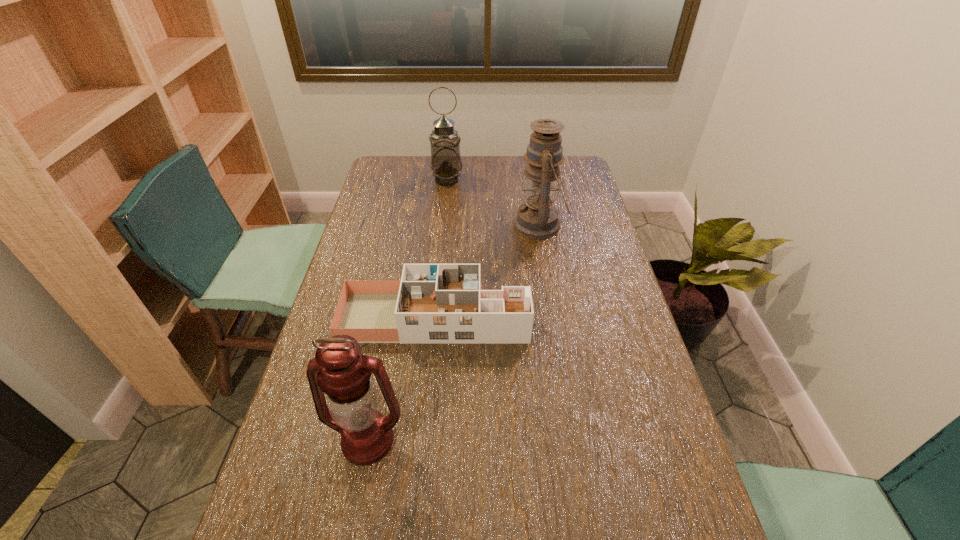
This screenshot has height=540, width=960. Find the location of `the second nearest oil lamp`. the second nearest oil lamp is located at coordinates coord(538,218).

This screenshot has height=540, width=960. In order to click on the second farthest object in this screenshot , I will do `click(538, 218)`.

You are a GUI agent. You are given a task and a screenshot of the screen. Output one action in this format:
    pyautogui.click(x=<x>, y=<y>)
    Task: Click on the farthest oil lamp
    
    Given the screenshot: What is the action you would take?
    tap(446, 165)

You are a GUI agent. You are given a task and a screenshot of the screen. Output one action in this format:
    pyautogui.click(x=<x>, y=<y>)
    Task: Click on the nearest oil lamp
    The image size is (960, 540).
    Given the screenshot: What is the action you would take?
    pyautogui.click(x=338, y=369)

Where is `the third farthest object`? the third farthest object is located at coordinates (436, 303).

This screenshot has width=960, height=540. I want to click on dollhouse, so click(436, 303).

Locate an element on the screen. Image resolution: width=960 pixels, height=540 pixels. vacant space situated on the right of the second nearest oil lamp is located at coordinates (596, 225).

Identify the location of vacant space located 0.280m on the right of the farthest oil lamp. The width and height of the screenshot is (960, 540). (531, 180).

Where is `vacant region located on the left of the nearest object`? vacant region located on the left of the nearest object is located at coordinates (295, 441).

You are a GUI agent. You are given a task and a screenshot of the screen. Output one action in this format:
    pyautogui.click(x=<x>, y=<y>)
    Task: Click on the blank space located at the entrance of the second nearest object
    
    Given the screenshot: What is the action you would take?
    pyautogui.click(x=583, y=317)